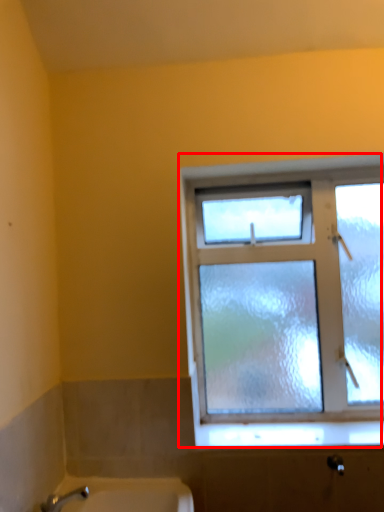
Question: From the image's perspective, where is window (annotated by the red box) located relative to window sill?

Choices:
 (A) above
 (B) below

Answer: (A)